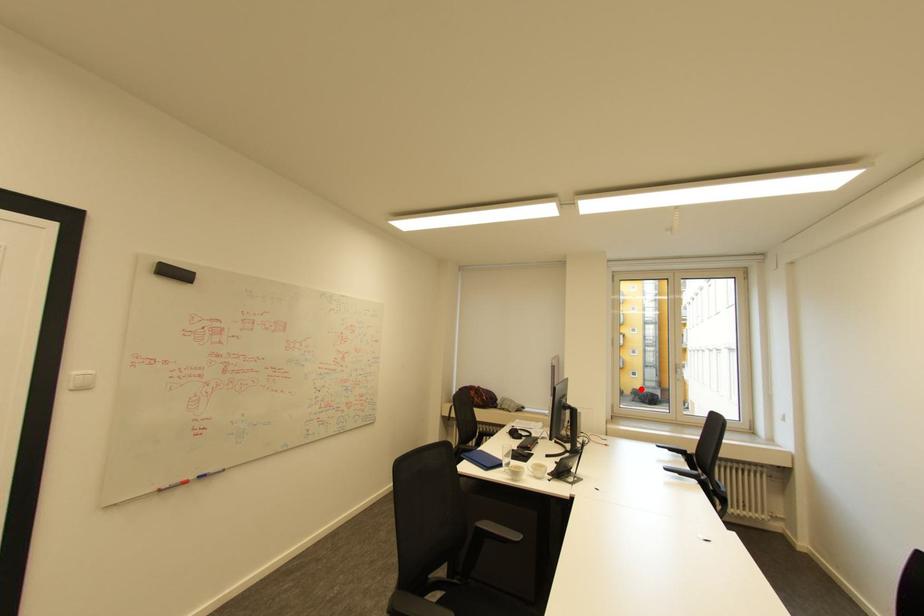
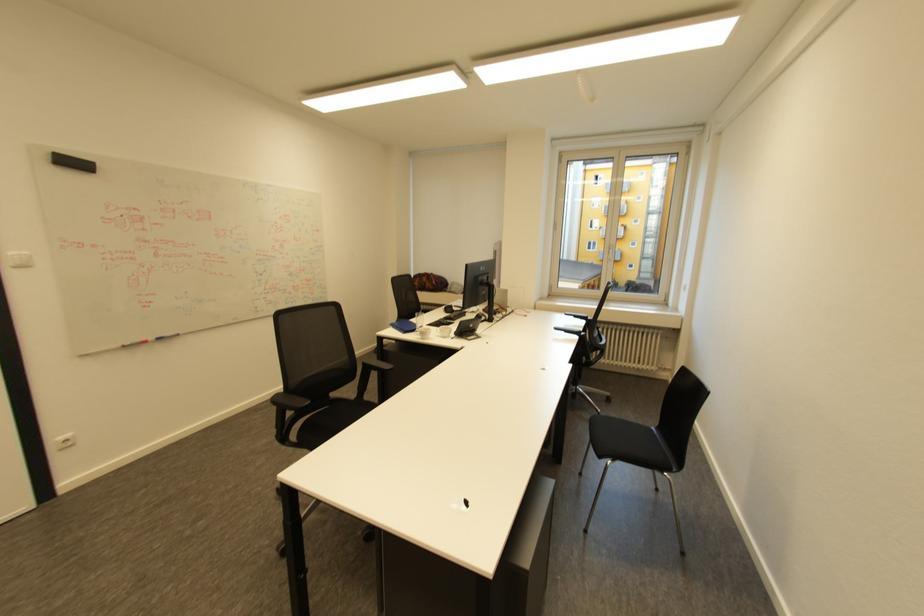
Find the pixel in the second image that matches the highlighted location in the first image.

(636, 281)